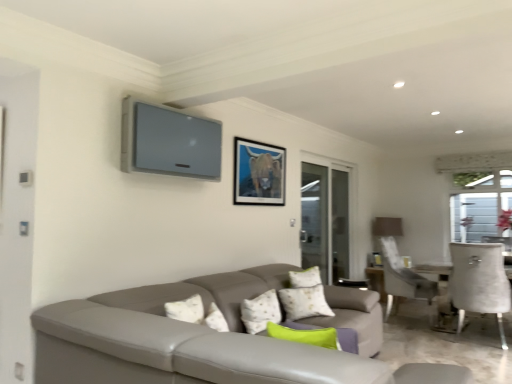
What is the approximate width of matte black picture frame at upper center?

The width of matte black picture frame at upper center is 2.17 inches.

Find the location of a particular element. transparent glass screen door at right is located at coordinates (325, 221).

Is transparent glass screen door at right taller than green fabric pillow at center?

Yes, transparent glass screen door at right is taller than green fabric pillow at center.

Are transparent glass screen door at right and green fabric pillow at center far apart?

Absolutely, transparent glass screen door at right is distant from green fabric pillow at center.

From the image's perspective, is transparent glass screen door at right beneath green fabric pillow at center?

No.

Can green fabric pillow at center be found inside transparent glass screen door at right?

No, green fabric pillow at center is not a part of transparent glass screen door at right.

In the scene shown: From the image's perspective, is green fabric pillow at center located beneath transparent glass screen door at right?

Yes, from the image's perspective, green fabric pillow at center is beneath transparent glass screen door at right.

From the picture: Which is farther, (257, 329) or (335, 260)?

The point (335, 260) is behind.

Is green fabric pillow at center next to transparent glass screen door at right?

No, green fabric pillow at center is not in contact with transparent glass screen door at right.

Is green fabric pillow at center turned away from transparent glass screen door at right?

No, green fabric pillow at center's orientation is not away from transparent glass screen door at right.

Does matte black picture frame at upper center lie behind transparent glass screen door at right?

No, matte black picture frame at upper center is closer to the camera.

Is point (245, 189) positioned after point (306, 208)?

No, it is in front of (306, 208).

Find the location of a particular element. This screenshot has height=384, width=512. picture frame lying in front of the transparent glass screen door at right is located at coordinates (258, 173).

Is matte black picture frame at upper center facing away from transparent glass screen door at right?

matte black picture frame at upper center does not have its back to transparent glass screen door at right.

Is point (250, 148) closer to viewer compared to point (247, 313)?

No, (250, 148) is behind (247, 313).

From the image's perspective, is matte black picture frame at upper center beneath green fabric pillow at center?

No, from the image's perspective, matte black picture frame at upper center is not below green fabric pillow at center.

Could you tell me if matte black picture frame at upper center is facing green fabric pillow at center?

No.

Considering the relative positions of matte black picture frame at upper center and green fabric pillow at center in the image provided, is matte black picture frame at upper center in front of green fabric pillow at center?

No, matte black picture frame at upper center is behind green fabric pillow at center.

From the picture: Does green fabric pillow at center lie behind matte black picture frame at upper center?

No, green fabric pillow at center is in front of matte black picture frame at upper center.

Consider the image. Can you confirm if green fabric pillow at center is smaller than matte black picture frame at upper center?

No.

Is green fabric pillow at center not close to matte black picture frame at upper center?

That's right, there is a large distance between green fabric pillow at center and matte black picture frame at upper center.

This screenshot has height=384, width=512. In order to click on picture frame located above the green fabric pillow at center (from the image's perspective) in this screenshot , I will do `click(258, 173)`.

Considering the positions of objects transparent glass screen door at right and matte black picture frame at upper center in the image provided, who is more to the right, transparent glass screen door at right or matte black picture frame at upper center?

transparent glass screen door at right.

Is transparent glass screen door at right taller or shorter than matte black picture frame at upper center?

In the image, transparent glass screen door at right appears to be taller than matte black picture frame at upper center.

Which point is more forward, (345, 185) or (248, 141)?

The point (248, 141) is more forward.

This screenshot has height=384, width=512. I want to click on pillow below the transparent glass screen door at right (from a real-world perspective), so pyautogui.click(x=260, y=311).

Find the location of a particular element. pillow on the left of transparent glass screen door at right is located at coordinates (x=260, y=311).

Consider the image. Considering their positions, is green fabric pillow at center positioned further to matte black picture frame at upper center than transparent glass screen door at right?

transparent glass screen door at right is positioned further to the anchor matte black picture frame at upper center.

From the image, which object appears to be farther from green fabric pillow at center, matte black picture frame at upper center or transparent glass screen door at right?

transparent glass screen door at right is positioned further to the anchor green fabric pillow at center.

When comparing their distances from matte black picture frame at upper center, does transparent glass screen door at right or green fabric pillow at center seem closer?

Among the two, green fabric pillow at center is located nearer to matte black picture frame at upper center.

Looking at the image, which one is located further to green fabric pillow at center, transparent glass screen door at right or matte black picture frame at upper center?

Based on the image, transparent glass screen door at right appears to be further to green fabric pillow at center.

Based on their spatial positions, is matte black picture frame at upper center or green fabric pillow at center closer to transparent glass screen door at right?

matte black picture frame at upper center is positioned closer to the anchor transparent glass screen door at right.

Considering their positions, is green fabric pillow at center positioned closer to transparent glass screen door at right than matte black picture frame at upper center?

Based on the image, matte black picture frame at upper center appears to be nearer to transparent glass screen door at right.

The width and height of the screenshot is (512, 384). I want to click on picture frame positioned between green fabric pillow at center and transparent glass screen door at right from near to far, so click(x=258, y=173).